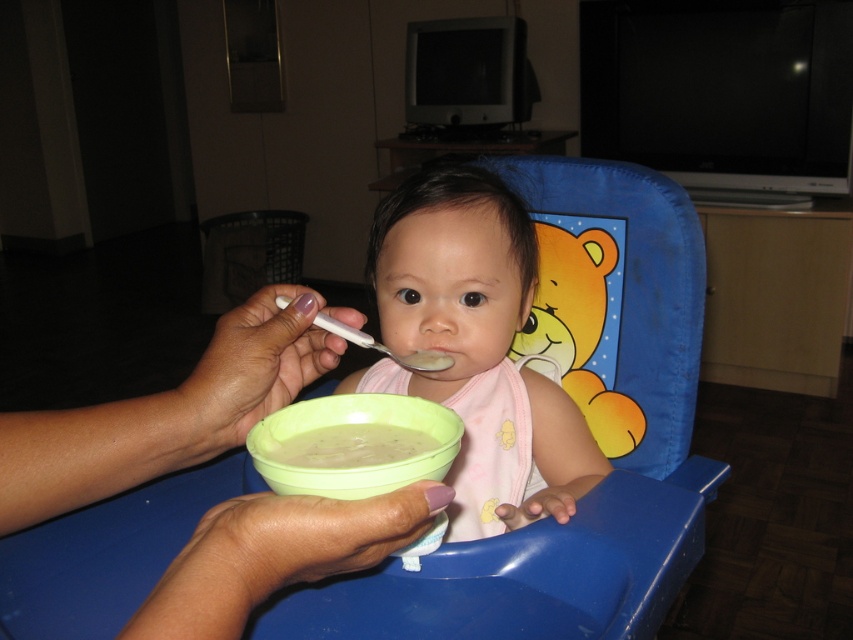
Question: Among these objects, which one is farthest from the camera?

Choices:
 (A) pink fabric baby at center
 (B) white plastic spoon at center
 (C) green plastic bowl at center
 (D) white creamy soup at center

Answer: (A)

Question: Can you confirm if pink fabric baby at center is wider than white plastic spoon at center?

Choices:
 (A) yes
 (B) no

Answer: (A)

Question: Which object is positioned farthest from the pink fabric baby at center?

Choices:
 (A) white creamy soup at center
 (B) white plastic spoon at center
 (C) green plastic bowl at center

Answer: (A)

Question: Which object is positioned closest to the white plastic spoon at center?

Choices:
 (A) white creamy soup at center
 (B) green plastic bowl at center

Answer: (B)

Question: Is white creamy soup at center to the right of white plastic spoon at center from the viewer's perspective?

Choices:
 (A) no
 (B) yes

Answer: (A)

Question: Does pink fabric baby at center lie behind white creamy soup at center?

Choices:
 (A) no
 (B) yes

Answer: (B)